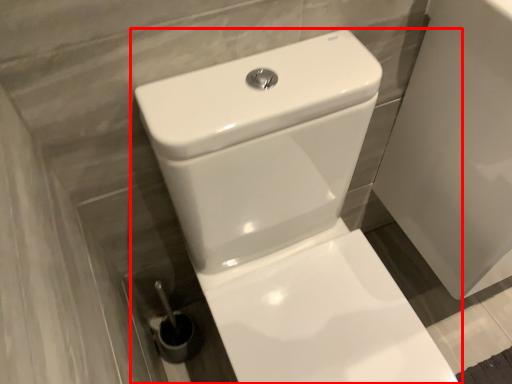
Question: From the image, what is the correct spatial relationship of toilet (annotated by the red box) in relation to porcelain?

Choices:
 (A) left
 (B) right

Answer: (A)